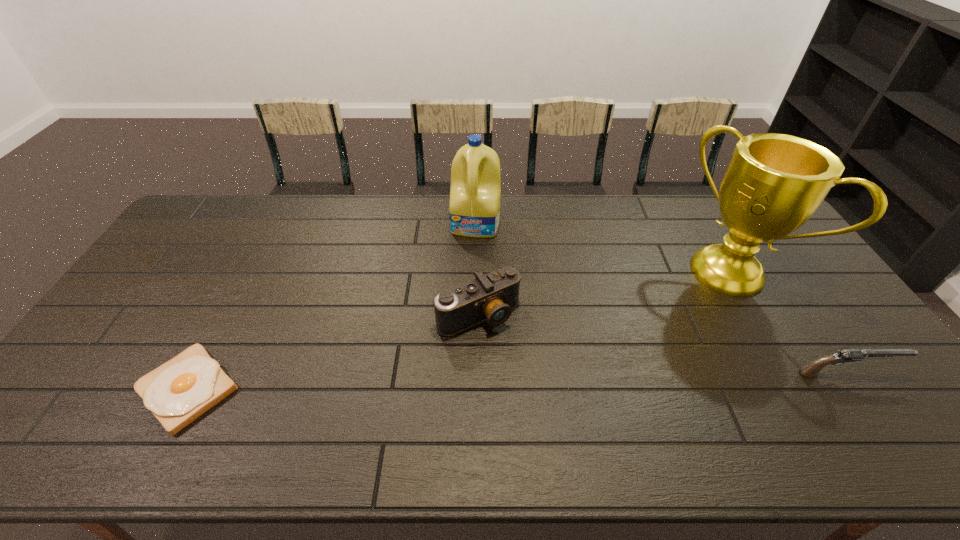
Locate an element on the screen. The image size is (960, 540). free space located on the label of the fourth shortest object is located at coordinates (456, 323).

Locate an element on the screen. free spot located 0.250m on the label of the fourth shortest object is located at coordinates (463, 292).

I want to click on vacant space located on the label of the fourth shortest object, so click(x=468, y=262).

Locate an element on the screen. vacant position located 0.060m on the shiny surface of the award is located at coordinates (694, 309).

Find the location of a particular element. free space located on the shiny surface of the award is located at coordinates [x=692, y=311].

This screenshot has width=960, height=540. I want to click on vacant space positioned 0.270m on the shiny surface of the award, so click(651, 347).

The width and height of the screenshot is (960, 540). I want to click on object present at the far edge, so click(x=475, y=190).

You are a GUI agent. You are given a task and a screenshot of the screen. Output one action in this format:
    pyautogui.click(x=<x>, y=<y>)
    Task: Click on the object located in the near edge section of the desktop
    Image resolution: width=960 pixels, height=540 pixels.
    Given the screenshot: What is the action you would take?
    pyautogui.click(x=178, y=392)

Find the location of a particular element. gun that is at the right edge is located at coordinates (812, 369).

The width and height of the screenshot is (960, 540). I want to click on award positioned at the right edge, so click(x=774, y=183).